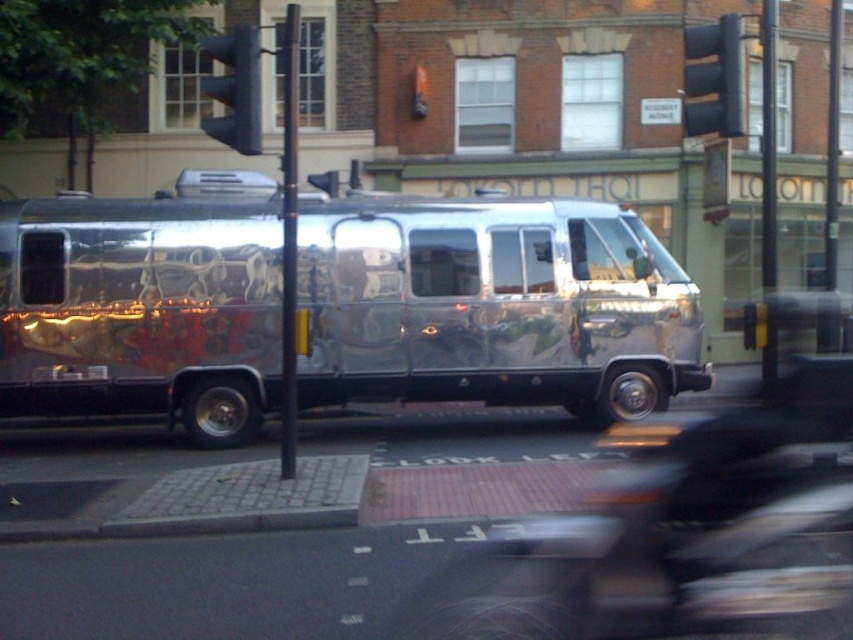
Question: Considering the relative positions of black plastic traffic light at upper right and blue plastic traffic light at upper center in the image provided, where is black plastic traffic light at upper right located with respect to blue plastic traffic light at upper center?

Choices:
 (A) below
 (B) above

Answer: (B)

Question: Which object is farther from the camera taking this photo?

Choices:
 (A) black plastic traffic light at upper right
 (B) blue plastic traffic light at upper center
 (C) shiny metallic van at center

Answer: (C)

Question: Which point is closer to the camera?

Choices:
 (A) blue plastic traffic light at upper center
 (B) black plastic traffic light at upper right

Answer: (A)

Question: Which object is farther from the camera taking this photo?

Choices:
 (A) blue plastic traffic light at upper center
 (B) shiny metallic van at center

Answer: (B)

Question: Does shiny metallic van at center appear on the left side of black plastic traffic light at upper right?

Choices:
 (A) yes
 (B) no

Answer: (A)

Question: Can you confirm if black plastic traffic light at upper right is positioned above blue plastic traffic light at upper center?

Choices:
 (A) yes
 (B) no

Answer: (A)